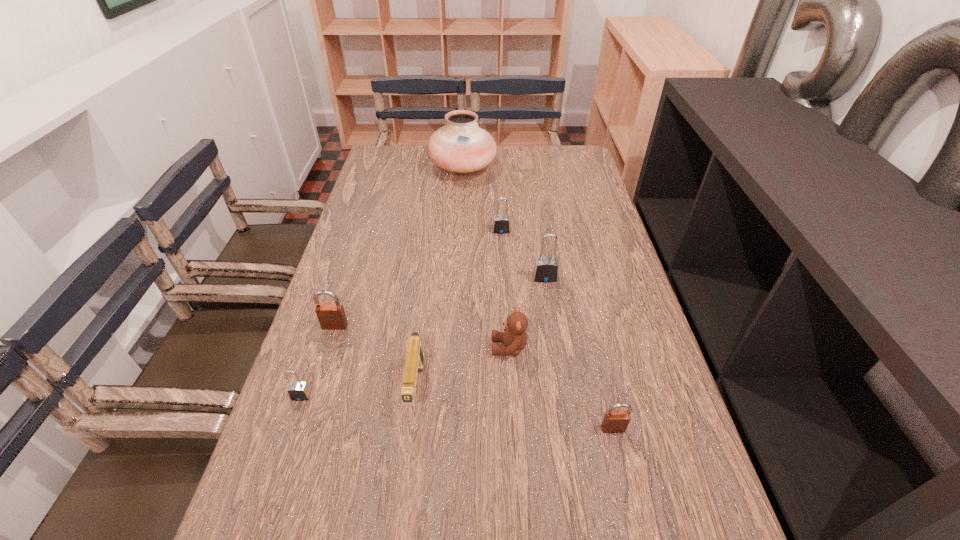
Point out which object is positioned as the nearest to the second farthest padlock. Please provide its 2D coordinates. Your answer should be formatted as a tuple, i.e. [(x, y)], where the tuple contains the x and y coordinates of a point satisfying the conditions above.

[(501, 224)]

Select which object is the fifth closest to the tallest object. Please provide its 2D coordinates. Your answer should be formatted as a tuple, i.e. [(x, y)], where the tuple contains the x and y coordinates of a point satisfying the conditions above.

[(414, 363)]

Where is `the second closest padlock to the fourth farthest object`? the second closest padlock to the fourth farthest object is located at coordinates pyautogui.click(x=545, y=269).

Identify the location of padlock that is the fifth closest to the brown teddy bear. The image size is (960, 540). (501, 224).

Find the location of `the closest gray padlock to the smaller brown padlock`. the closest gray padlock to the smaller brown padlock is located at coordinates (545, 269).

Identify the location of gray padlock that is the third closest to the pistol. The height and width of the screenshot is (540, 960). (501, 224).